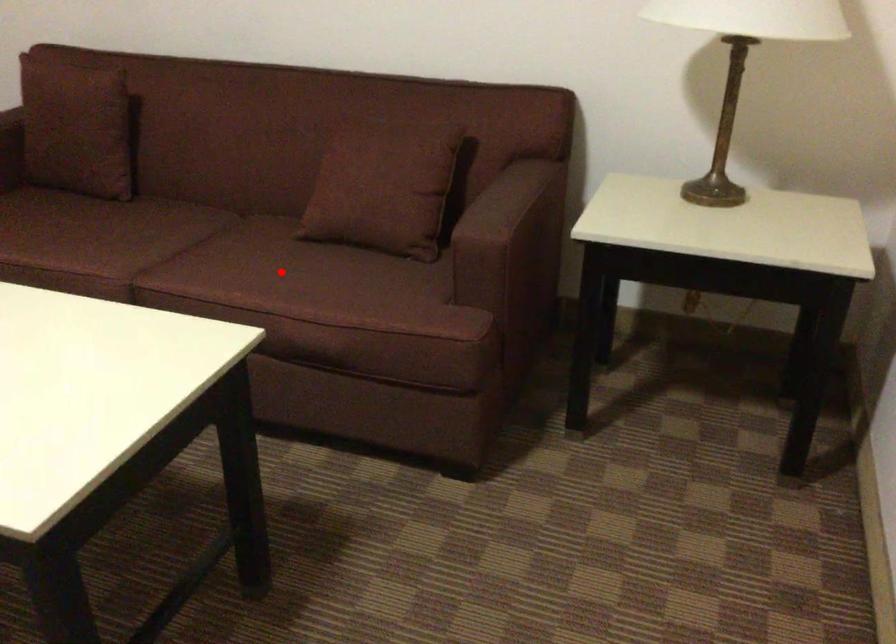
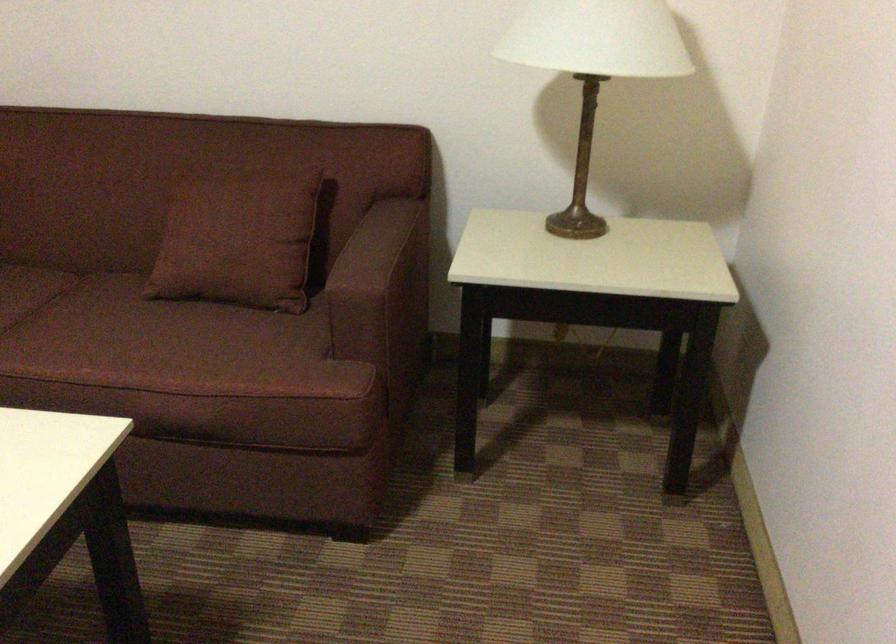
In the second image, find the point that corresponds to the highlighted location in the first image.

(135, 339)